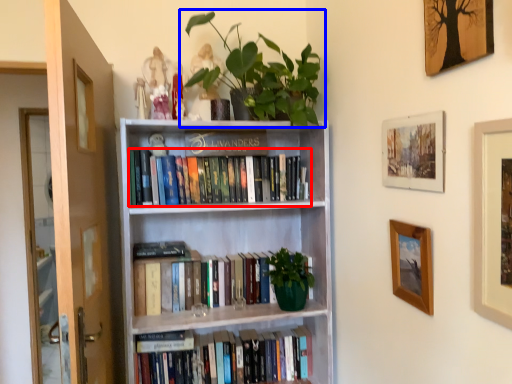
Question: Which object is further to the camera taking this photo, book (highlighted by a red box) or houseplant (highlighted by a blue box)?

Choices:
 (A) book
 (B) houseplant

Answer: (A)